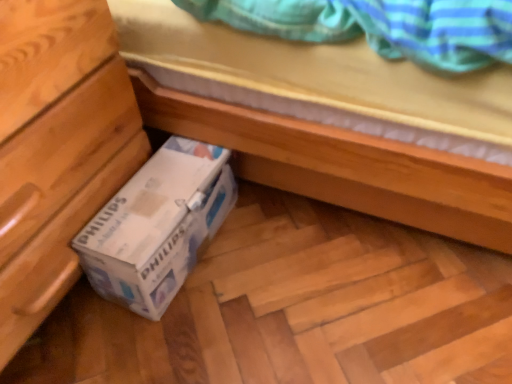
The width and height of the screenshot is (512, 384). In order to click on vacant space situated above white cardboard box at lower left (from a real-world perspective) in this screenshot , I will do `click(156, 190)`.